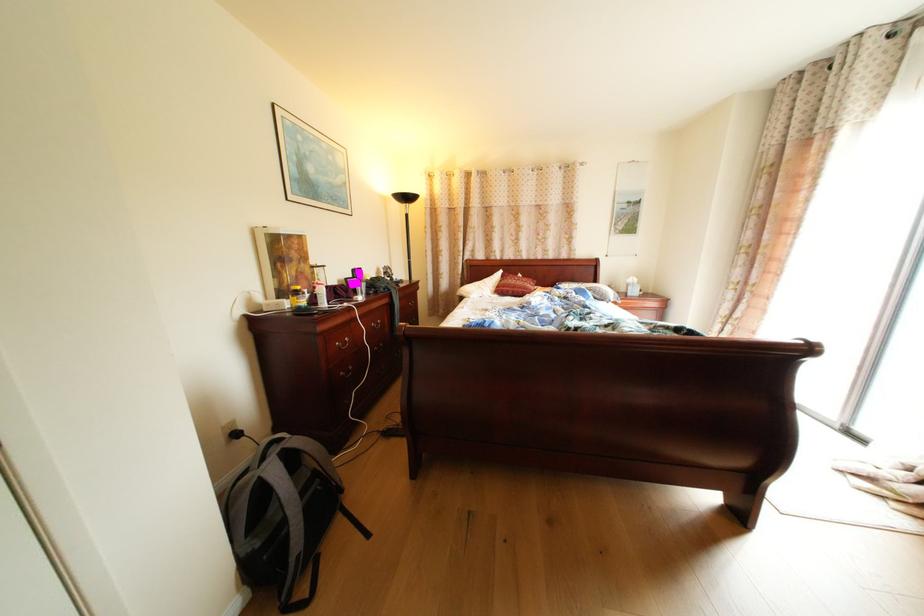
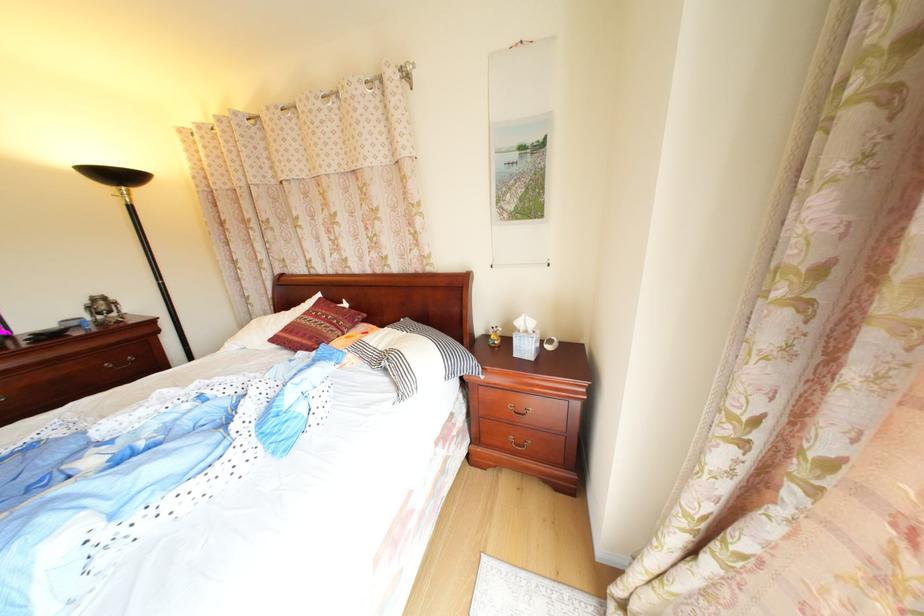
In the second image, find the point that corresponds to (526,293) in the first image.

(304, 342)